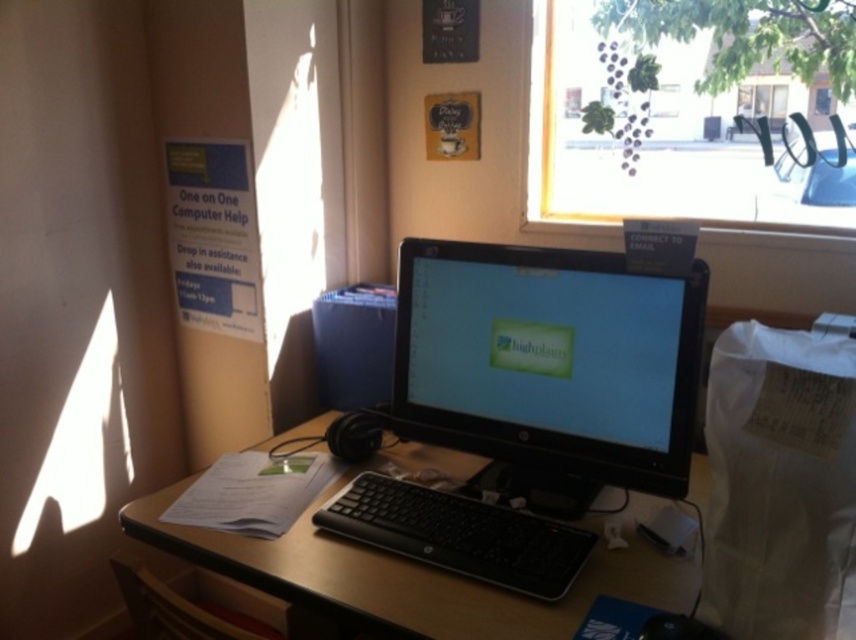
You are organizing the desk and need to place a new monitor on the black plastic computer desk at center. However, you notice the black plastic keyboard at center is in the way. Where exactly should you move the keyboard to make space?

The black plastic keyboard at center should be moved below the black plastic computer desk at center since the desk is above the keyboard according to the description.

You are setting up a new webcam for video calls. The webcam needs to be placed directly above the black plastic monitor at center to ensure the best framing. Given the monitor is at coordinates point 0.567, 0.636, where should you position the webcam?

The webcam should be positioned directly above the black plastic monitor at center, which is located at point [544,362]. Therefore, the webcam should be placed at coordinates slightly higher than 0.636 on the y axis while maintaining the same x coordinate of 0.567 to ensure proper alignment.